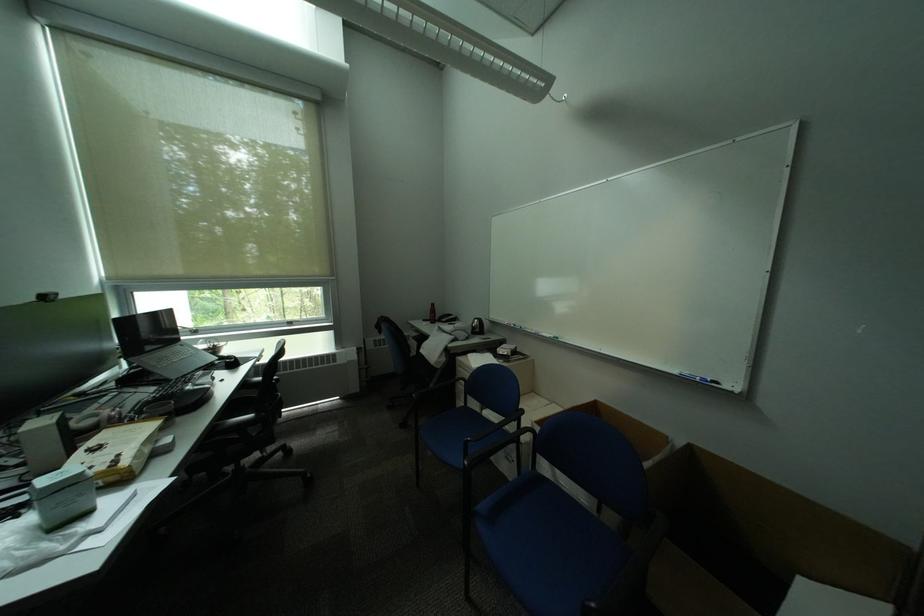
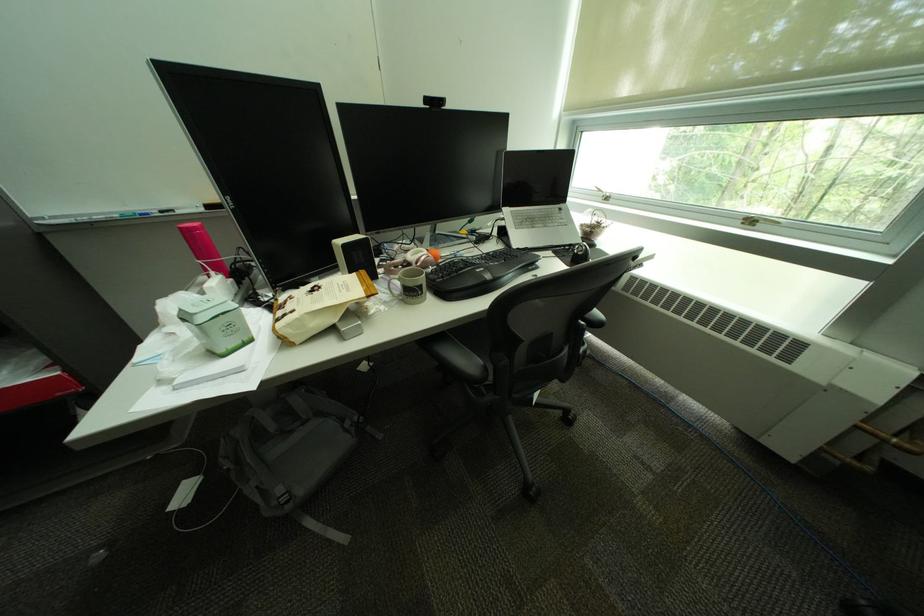
In the second image, find the point that corresponds to point (301, 323) in the first image.

(761, 224)